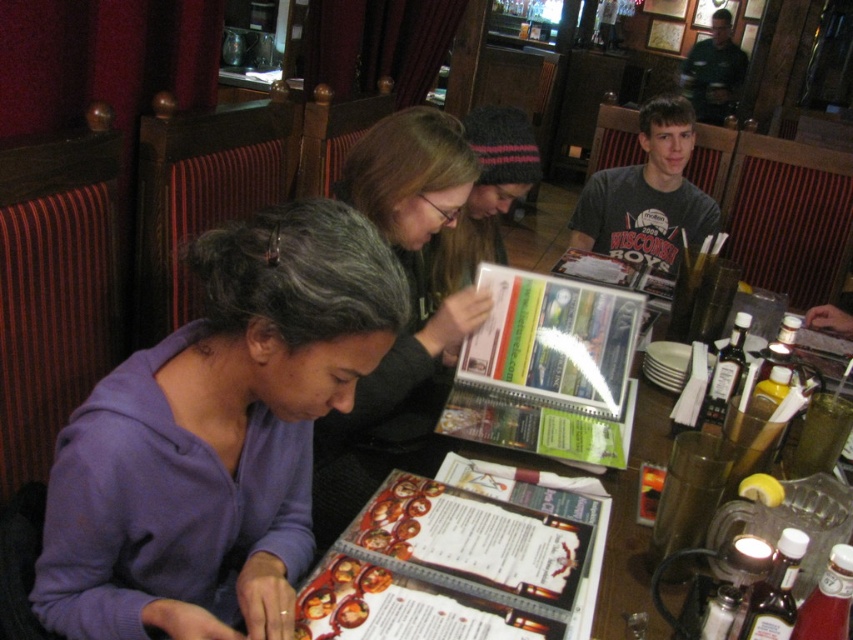
Question: Is gray cotton shirt at upper right positioned in front of green uniform shirt at upper right?

Choices:
 (A) no
 (B) yes

Answer: (B)

Question: Which object is the closest to the gray cotton shirt at upper right?

Choices:
 (A) printed paper menu at center
 (B) matte black hair at center
 (C) green uniform shirt at upper right

Answer: (B)

Question: Which object appears farthest from the camera in this image?

Choices:
 (A) gray cotton shirt at upper right
 (B) purple fleece jacket at lower left

Answer: (A)

Question: Is the position of matte black hair at center less distant than that of printed paper menu at center?

Choices:
 (A) yes
 (B) no

Answer: (B)

Question: Which point is farther to the camera?

Choices:
 (A) purple fleece jacket at lower left
 (B) matte black hair at center

Answer: (B)

Question: Does printed paper menu at center appear under green uniform shirt at upper right?

Choices:
 (A) yes
 (B) no

Answer: (A)